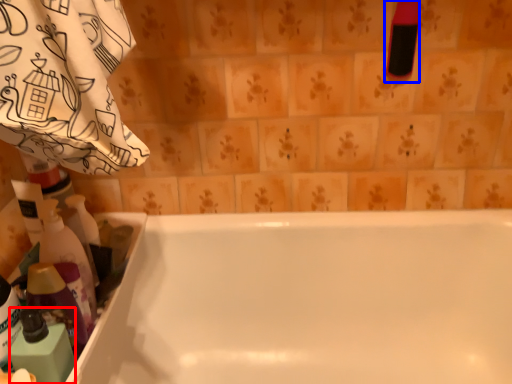
Question: Which of the following is the closest to the observer, cleaning product (highlighted by a red box) or cleaning product (highlighted by a blue box)?

Choices:
 (A) cleaning product
 (B) cleaning product

Answer: (A)